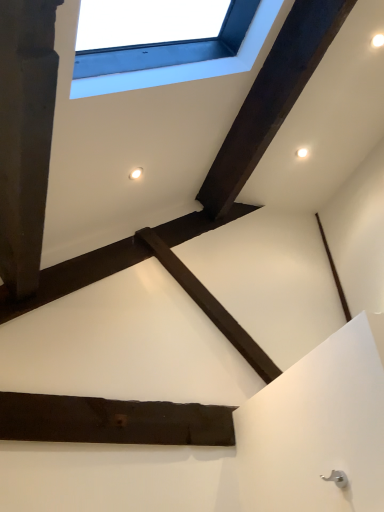
Question: Can you confirm if white plastic window at upper center is positioned to the left of dark brown wood at upper center, the 1th plank in the top-to-bottom sequence?

Choices:
 (A) no
 (B) yes

Answer: (B)

Question: Is the position of white plastic window at upper center more distant than that of dark brown wood at upper center, acting as the 1th plank starting from the right?

Choices:
 (A) no
 (B) yes

Answer: (A)

Question: Are white plastic window at upper center and dark brown wood at upper center, the second plank from the left, making contact?

Choices:
 (A) no
 (B) yes

Answer: (A)

Question: Can you confirm if white plastic window at upper center is shorter than dark brown wood at upper center, acting as the 1th plank starting from the right?

Choices:
 (A) no
 (B) yes

Answer: (A)

Question: From a real-world perspective, is white plastic window at upper center positioned under dark brown wood at upper center, acting as the 1th plank starting from the right, based on gravity?

Choices:
 (A) no
 (B) yes

Answer: (B)

Question: From their relative heights in the image, would you say dark wood plank at center, placed as the 2th plank when sorted from top to bottom, is taller or shorter than white plastic window at upper center?

Choices:
 (A) tall
 (B) short

Answer: (B)

Question: Based on their sizes in the image, would you say dark wood plank at center, which is the 1th plank from left to right, is bigger or smaller than white plastic window at upper center?

Choices:
 (A) small
 (B) big

Answer: (A)

Question: Considering their positions, is dark wood plank at center, the first plank from the bottom, located in front of or behind white plastic window at upper center?

Choices:
 (A) behind
 (B) front

Answer: (A)

Question: From a real-world perspective, is dark wood plank at center, the first plank from the bottom, above or below white plastic window at upper center?

Choices:
 (A) below
 (B) above

Answer: (A)

Question: Is dark wood plank at center, which is counted as the second plank, starting from the right, bigger or smaller than dark brown wood at upper center, the second plank from the left?

Choices:
 (A) small
 (B) big

Answer: (A)

Question: Considering the positions of point (216, 433) and point (286, 47), is point (216, 433) closer or farther from the camera than point (286, 47)?

Choices:
 (A) closer
 (B) farther

Answer: (B)

Question: Considering the positions of dark wood plank at center, which is the 1th plank from left to right, and dark brown wood at upper center, the 1th plank in the top-to-bottom sequence, in the image, is dark wood plank at center, which is the 1th plank from left to right, wider or thinner than dark brown wood at upper center, the 1th plank in the top-to-bottom sequence,?

Choices:
 (A) thin
 (B) wide

Answer: (A)

Question: Considering the positions of dark wood plank at center, which is the 1th plank from left to right, and dark brown wood at upper center, acting as the 1th plank starting from the right, in the image, is dark wood plank at center, which is the 1th plank from left to right, taller or shorter than dark brown wood at upper center, acting as the 1th plank starting from the right,?

Choices:
 (A) short
 (B) tall

Answer: (B)

Question: Based on their positions, is dark brown wood at upper center, the second plank ordered from the bottom, located to the left or right of dark wood plank at center, which is the 1th plank from left to right?

Choices:
 (A) right
 (B) left

Answer: (A)

Question: Relative to dark wood plank at center, which is the 1th plank from left to right, is dark brown wood at upper center, acting as the 1th plank starting from the right, in front or behind?

Choices:
 (A) behind
 (B) front

Answer: (A)